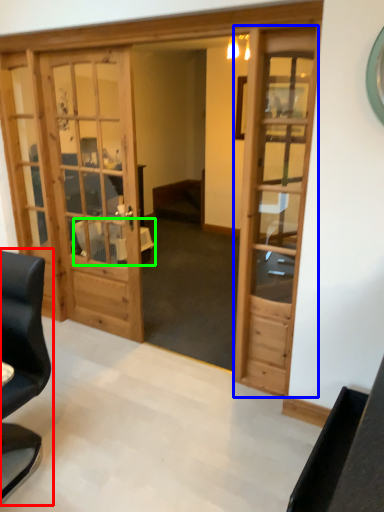
Question: Estimate the real-world distances between objects in this image. Which object is farther from chair (highlighted by a red box), door (highlighted by a blue box) or table (highlighted by a green box)?

Choices:
 (A) door
 (B) table

Answer: (B)